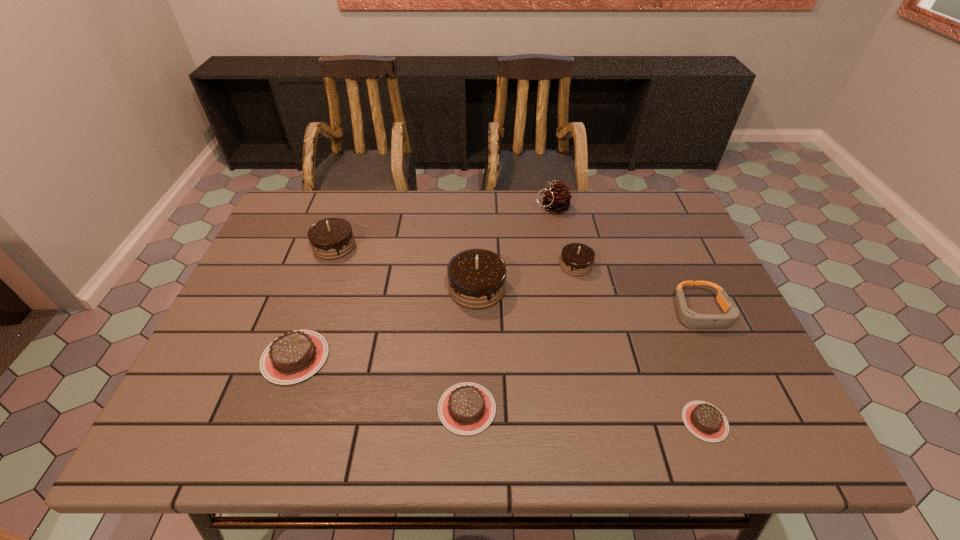
At what (x,y) coordinates should I click in order to perform the action: click on the leftmost brown chocolate cake. Please return your answer as a coordinate pair (x, y). The image size is (960, 540). Looking at the image, I should click on (293, 357).

You are a GUI agent. You are given a task and a screenshot of the screen. Output one action in this format:
    pyautogui.click(x=<x>, y=<y>)
    Task: Click on the second smallest brown chocolate cake
    Image resolution: width=960 pixels, height=540 pixels.
    Given the screenshot: What is the action you would take?
    pyautogui.click(x=467, y=408)

Identify the location of the fifth tallest chocolate cake. (467, 408).

Where is `the rightmost chocolate cake`? The width and height of the screenshot is (960, 540). the rightmost chocolate cake is located at coordinates (704, 420).

The image size is (960, 540). I want to click on the rightmost brown chocolate cake, so pos(704,420).

This screenshot has height=540, width=960. Identify the location of vacant space located 0.050m on the left of the second chocolate chocolate cake from right to left. (430, 288).

Identify the location of free spot located 0.050m with a leaf charm attached to the farthest object. (519, 207).

Locate an element on the screen. This screenshot has width=960, height=540. blank space located 0.140m with a leaf charm attached to the farthest object is located at coordinates (492, 207).

Locate an element on the screen. The height and width of the screenshot is (540, 960). vacant space situated 0.180m with a leaf charm attached to the farthest object is located at coordinates (479, 207).

Locate an element on the screen. vacant space situated 0.080m on the left of the fifth shortest chocolate cake is located at coordinates (286, 246).